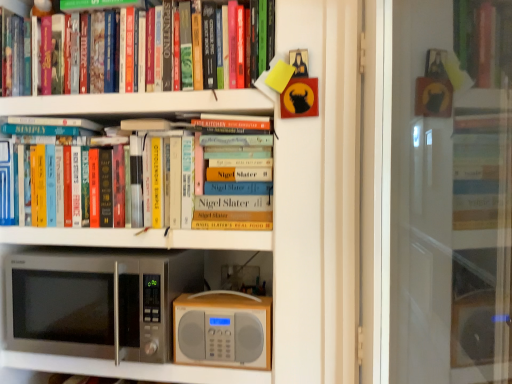
The image size is (512, 384). I want to click on satin silver microwave at lower left, so click(x=97, y=302).

Where is `transparent glass screen door at upper center`? The image size is (512, 384). transparent glass screen door at upper center is located at coordinates (451, 192).

What is the approximate width of transparent glass screen door at upper center?

transparent glass screen door at upper center is 6.81 inches wide.

This screenshot has width=512, height=384. I want to click on hardcover books at upper left, arranged as the 2th book when ordered from the bottom, so click(261, 36).

From the image's perspective, would you say hardcover books at upper left, arranged as the 2th book when ordered from the bottom, is shown under wooden radio at center?

Actually, hardcover books at upper left, arranged as the 2th book when ordered from the bottom, appears above wooden radio at center in the image.

Considering the sizes of objects hardcover books at upper left, the first book viewed from the top, and wooden radio at center in the image provided, who is shorter, hardcover books at upper left, the first book viewed from the top, or wooden radio at center?

wooden radio at center is shorter.

From a real-world perspective, between hardcover books at upper left, arranged as the 2th book when ordered from the bottom, and wooden radio at center, who is vertically higher?

hardcover books at upper left, arranged as the 2th book when ordered from the bottom.

Who is smaller, hardcover books at upper left, arranged as the 2th book when ordered from the bottom, or wooden radio at center?

wooden radio at center is smaller.

In the image, is hardcover books at upper left, arranged as the 2th book when ordered from the bottom, positioned in front of or behind hardcover books at center, positioned as the 1th book in bottom-to-top order?

Clearly, hardcover books at upper left, arranged as the 2th book when ordered from the bottom, is in front of hardcover books at center, positioned as the 1th book in bottom-to-top order.

Looking at this image, is there a large distance between hardcover books at upper left, arranged as the 2th book when ordered from the bottom, and hardcover books at center, positioned as the 1th book in bottom-to-top order?

No, there isn't a large distance between hardcover books at upper left, arranged as the 2th book when ordered from the bottom, and hardcover books at center, positioned as the 1th book in bottom-to-top order.

From a real-world perspective, is hardcover books at upper left, the first book viewed from the top, positioned above or below hardcover books at center, placed as the 2th book when sorted from top to bottom?

From a real-world perspective, hardcover books at upper left, the first book viewed from the top, is physically above hardcover books at center, placed as the 2th book when sorted from top to bottom.

From the image's perspective, is hardcover books at center, positioned as the 1th book in bottom-to-top order, above or below hardcover books at upper left, the first book viewed from the top?

From the image's perspective, hardcover books at center, positioned as the 1th book in bottom-to-top order, appears below hardcover books at upper left, the first book viewed from the top.

Would you say hardcover books at center, positioned as the 1th book in bottom-to-top order, is a long distance from hardcover books at upper left, arranged as the 2th book when ordered from the bottom?

No, hardcover books at center, positioned as the 1th book in bottom-to-top order, is not far from hardcover books at upper left, arranged as the 2th book when ordered from the bottom.

Between hardcover books at center, positioned as the 1th book in bottom-to-top order, and hardcover books at upper left, arranged as the 2th book when ordered from the bottom, which one has larger width?

hardcover books at upper left, arranged as the 2th book when ordered from the bottom, is wider.

Consider the image. Which of these two, hardcover books at center, placed as the 2th book when sorted from top to bottom, or wooden radio at center, stands taller?

hardcover books at center, placed as the 2th book when sorted from top to bottom, is taller.

From a real-world perspective, is hardcover books at center, positioned as the 1th book in bottom-to-top order, physically below wooden radio at center?

No, from a real-world perspective, hardcover books at center, positioned as the 1th book in bottom-to-top order, is not beneath wooden radio at center.

Between hardcover books at center, placed as the 2th book when sorted from top to bottom, and wooden radio at center, which one is positioned behind?

Positioned behind is hardcover books at center, placed as the 2th book when sorted from top to bottom.

Is hardcover books at center, placed as the 2th book when sorted from top to bottom, located outside wooden radio at center?

Yes.

Considering the points (238, 339) and (148, 194), which point is behind, point (238, 339) or point (148, 194)?

Point (148, 194)

Is wooden radio at center looking in the opposite direction of hardcover books at center, placed as the 2th book when sorted from top to bottom?

No, wooden radio at center is not facing the opposite direction of hardcover books at center, placed as the 2th book when sorted from top to bottom.

Between wooden radio at center and hardcover books at center, positioned as the 1th book in bottom-to-top order, which one is positioned in front?

wooden radio at center is more forward.

In the scene shown: From a real-world perspective, who is located higher, satin silver microwave at lower left or hardcover books at center, positioned as the 1th book in bottom-to-top order?

From a 3D spatial view, hardcover books at center, positioned as the 1th book in bottom-to-top order, is above.

Who is smaller, satin silver microwave at lower left or hardcover books at center, positioned as the 1th book in bottom-to-top order?

With smaller size is hardcover books at center, positioned as the 1th book in bottom-to-top order.

Is satin silver microwave at lower left facing away from hardcover books at center, placed as the 2th book when sorted from top to bottom?

satin silver microwave at lower left is not turned away from hardcover books at center, placed as the 2th book when sorted from top to bottom.

Between transparent glass screen door at upper center and hardcover books at center, placed as the 2th book when sorted from top to bottom, which one has larger width?

With larger width is transparent glass screen door at upper center.

Between transparent glass screen door at upper center and hardcover books at center, placed as the 2th book when sorted from top to bottom, which one has larger size?

transparent glass screen door at upper center is bigger.

Considering the relative positions of transparent glass screen door at upper center and hardcover books at center, positioned as the 1th book in bottom-to-top order, in the image provided, is transparent glass screen door at upper center to the right of hardcover books at center, positioned as the 1th book in bottom-to-top order, from the viewer's perspective?

Correct, you'll find transparent glass screen door at upper center to the right of hardcover books at center, positioned as the 1th book in bottom-to-top order.

From the picture: Is transparent glass screen door at upper center taller or shorter than hardcover books at center, placed as the 2th book when sorted from top to bottom?

Clearly, transparent glass screen door at upper center is taller compared to hardcover books at center, placed as the 2th book when sorted from top to bottom.

Image resolution: width=512 pixels, height=384 pixels. In order to click on appliance below the hardcover books at upper left, arranged as the 2th book when ordered from the bottom (from the image's perspective) in this screenshot , I will do `click(222, 329)`.

At what (x,y) coordinates should I click in order to perform the action: click on book that appears in front of the hardcover books at center, positioned as the 1th book in bottom-to-top order. Please return your answer as a coordinate pair (x, y). The width and height of the screenshot is (512, 384). Looking at the image, I should click on (261, 36).

Looking at the image, which one is located further to hardcover books at upper left, the first book viewed from the top, satin silver microwave at lower left or hardcover books at center, placed as the 2th book when sorted from top to bottom?

Among the two, satin silver microwave at lower left is located further to hardcover books at upper left, the first book viewed from the top.

Considering their positions, is transparent glass screen door at upper center positioned further to hardcover books at upper left, the first book viewed from the top, than wooden radio at center?

transparent glass screen door at upper center lies further to hardcover books at upper left, the first book viewed from the top, than the other object.

Looking at this image, from the image, which object appears to be farther from hardcover books at upper left, the first book viewed from the top, satin silver microwave at lower left or wooden radio at center?

satin silver microwave at lower left.

In the scene shown: Looking at the image, which one is located further to satin silver microwave at lower left, transparent glass screen door at upper center or hardcover books at center, positioned as the 1th book in bottom-to-top order?

transparent glass screen door at upper center is further to satin silver microwave at lower left.

From the image, which object appears to be farther from satin silver microwave at lower left, wooden radio at center or hardcover books at center, positioned as the 1th book in bottom-to-top order?

The object further to satin silver microwave at lower left is hardcover books at center, positioned as the 1th book in bottom-to-top order.

Consider the image. Looking at the image, which one is located closer to transparent glass screen door at upper center, satin silver microwave at lower left or hardcover books at center, placed as the 2th book when sorted from top to bottom?

Among the two, hardcover books at center, placed as the 2th book when sorted from top to bottom, is located nearer to transparent glass screen door at upper center.

From the image, which object appears to be nearer to hardcover books at center, positioned as the 1th book in bottom-to-top order, hardcover books at upper left, arranged as the 2th book when ordered from the bottom, or transparent glass screen door at upper center?

The object closer to hardcover books at center, positioned as the 1th book in bottom-to-top order, is hardcover books at upper left, arranged as the 2th book when ordered from the bottom.

When comparing their distances from satin silver microwave at lower left, does wooden radio at center or transparent glass screen door at upper center seem closer?

wooden radio at center lies closer to satin silver microwave at lower left than the other object.

Where is `book between transparent glass screen door at upper center and hardcover books at center, positioned as the 1th book in bottom-to-top order, from front to back`? book between transparent glass screen door at upper center and hardcover books at center, positioned as the 1th book in bottom-to-top order, from front to back is located at coordinates (261, 36).

Image resolution: width=512 pixels, height=384 pixels. What are the coordinates of `microwave oven between hardcover books at upper left, the first book viewed from the top, and wooden radio at center in the up-down direction` in the screenshot? It's located at (97, 302).

Find the location of a particular element. The width and height of the screenshot is (512, 384). microwave oven positioned between transparent glass screen door at upper center and wooden radio at center from near to far is located at coordinates (97, 302).

Where is `book between transparent glass screen door at upper center and satin silver microwave at lower left in the front-back direction`? This screenshot has height=384, width=512. book between transparent glass screen door at upper center and satin silver microwave at lower left in the front-back direction is located at coordinates (261, 36).